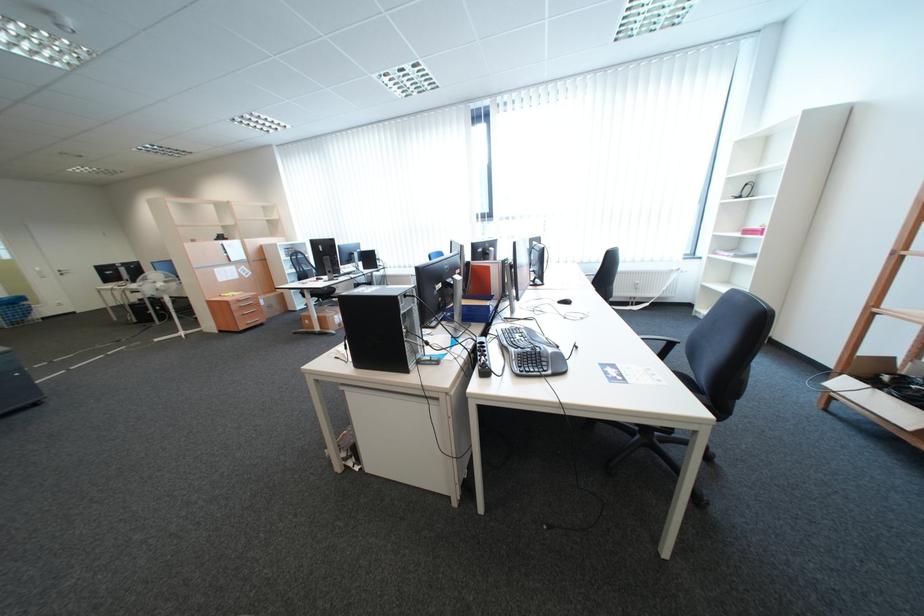
You are a GUI agent. You are given a task and a screenshot of the screen. Output one action in this format:
    pyautogui.click(x=<x>, y=<y>)
    Task: Click on the computer mouse
    
    Given the screenshot: What is the action you would take?
    pyautogui.click(x=564, y=301)